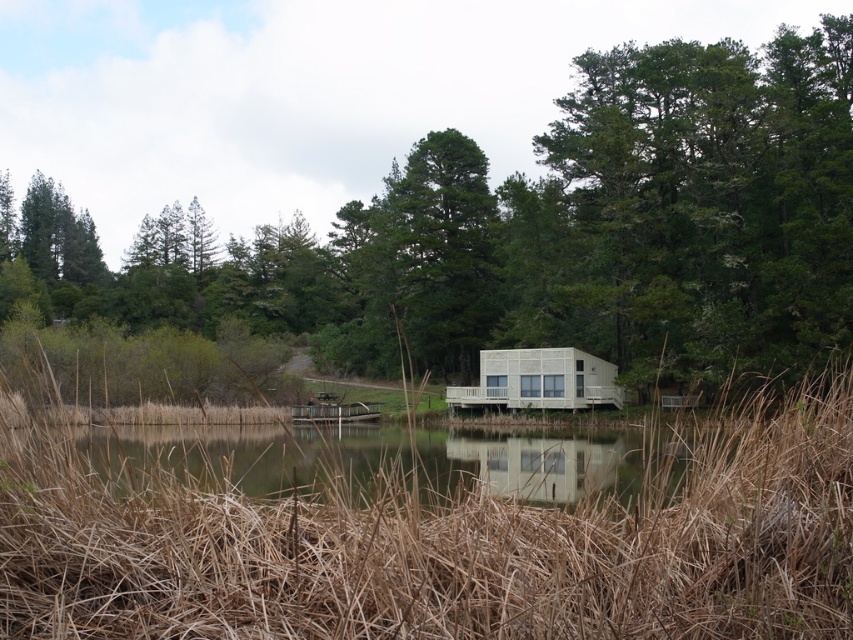
Can you confirm if brown dry reed at center is thinner than clear water at center?

Yes.

Does point (793, 435) lie behind point (511, 486)?

That is False.

Find the location of a particular element. The width and height of the screenshot is (853, 640). brown dry reed at center is located at coordinates (445, 548).

In the scene shown: Between green leafy tree at center and clear water at center, which one appears on the left side from the viewer's perspective?

From the viewer's perspective, green leafy tree at center appears more on the left side.

Which is more to the right, green leafy tree at center or clear water at center?

clear water at center

Identify the location of green leafy tree at center. (531, 232).

Does green leafy tree at center have a smaller size compared to brown dry reed at center?

Actually, green leafy tree at center might be larger than brown dry reed at center.

Between green leafy tree at center and brown dry reed at center, which one has less height?

brown dry reed at center

Who is more forward, (804, 179) or (88, 499)?

Point (88, 499) is in front.

The image size is (853, 640). I want to click on green leafy tree at center, so click(531, 232).